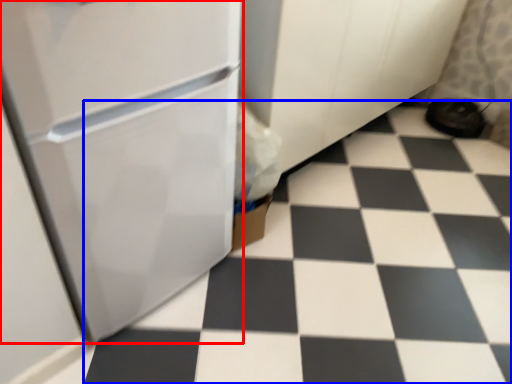
Question: Which object is closer to the camera taking this photo, refrigerator (highlighted by a red box) or tile (highlighted by a blue box)?

Choices:
 (A) refrigerator
 (B) tile

Answer: (A)